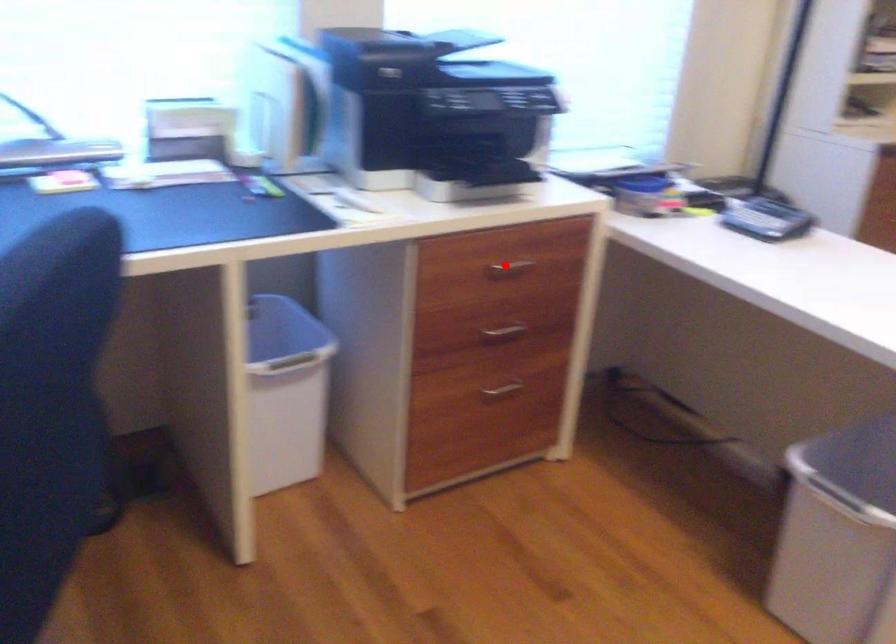
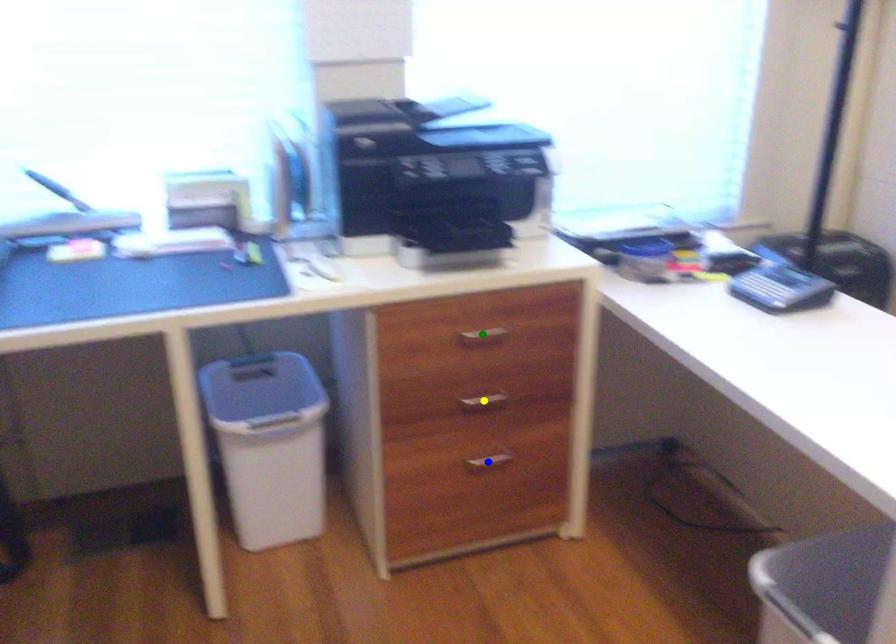
Question: I am providing you with two images of the same scene from different viewpoints. A red point is marked on the first image. You are given multiple points on the second image. Which mark in image 2 goes with the point in image 1?

Choices:
 (A) green point
 (B) yellow point
 (C) blue point

Answer: (A)